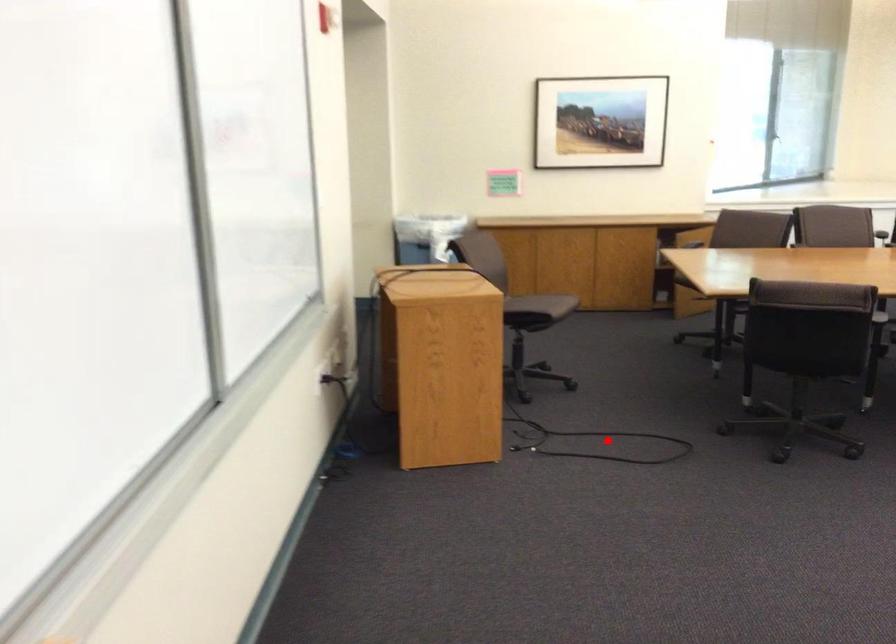
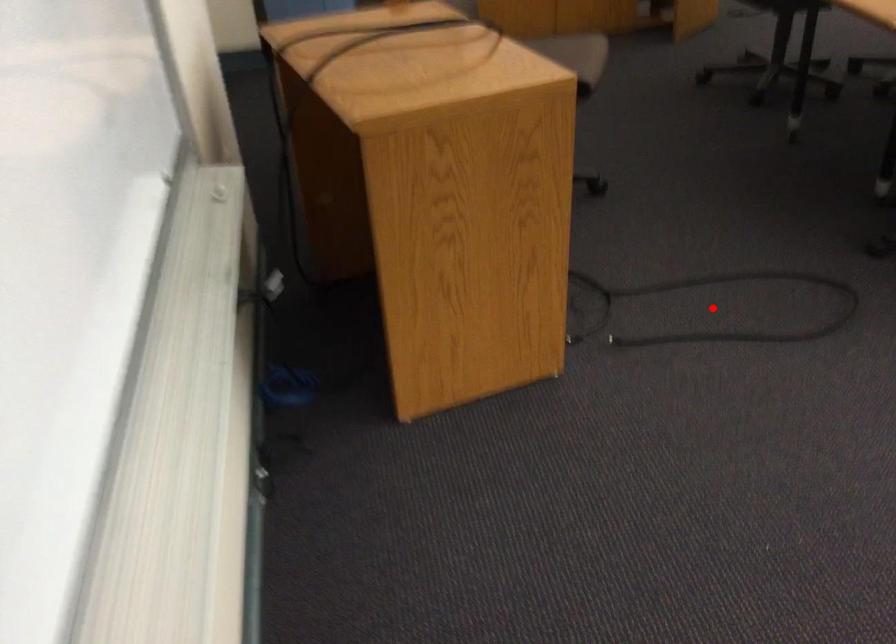
I am providing you with two images of the same scene from different viewpoints. A red point is marked on the first image and another point is marked on the second image. Does the point marked in image1 correspond to the same location as the one in image2?

Yes